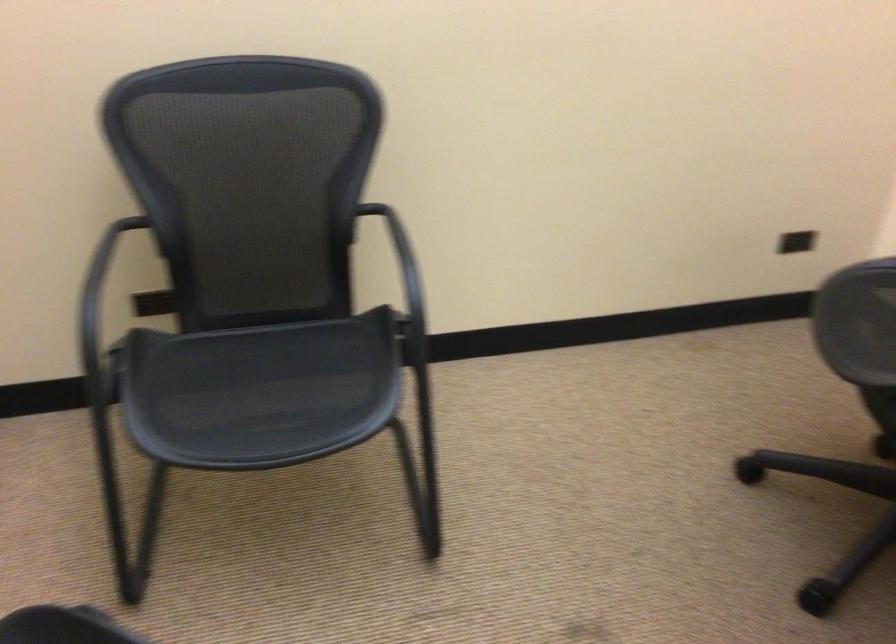
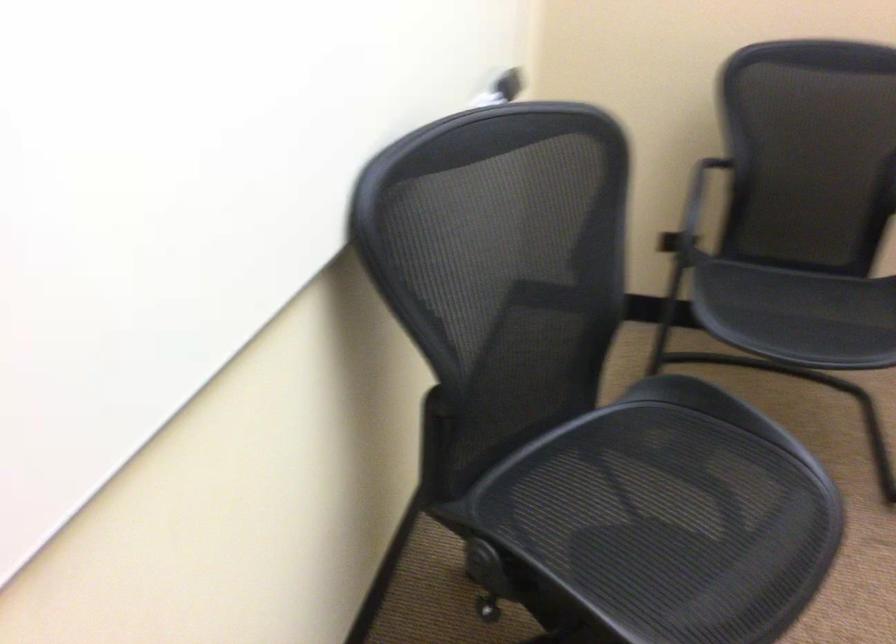
Find the pixel in the second image that matches pixel 269 413 in the first image.

(798, 315)